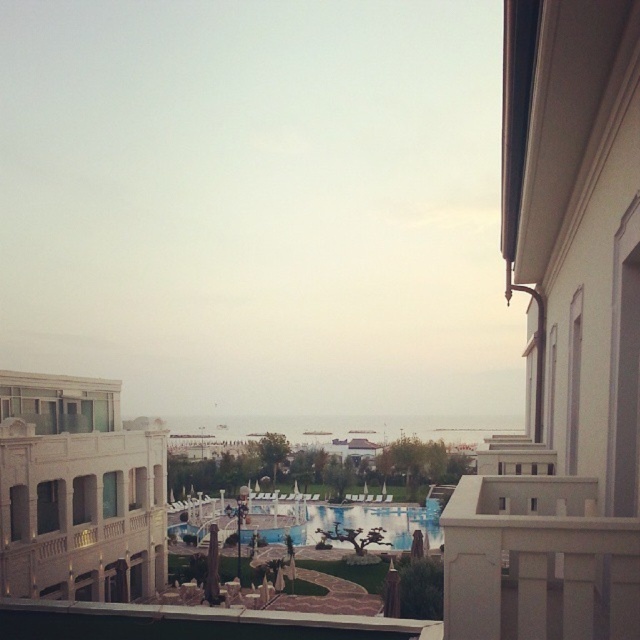
Who is positioned more to the right, white smooth building at right or white stone building at left?

Positioned to the right is white smooth building at right.

Is white smooth building at right to the right of white stone building at left from the viewer's perspective?

Yes, white smooth building at right is to the right of white stone building at left.

Is point (561, 44) more distant than point (67, 540)?

No, it is not.

Find the location of a particular element. white smooth building at right is located at coordinates (563, 342).

Can you confirm if white concrete balustrade at upper right is bigger than blue glossy pool at center?

No.

Does white concrete balustrade at upper right lie in front of blue glossy pool at center?

Yes.

At what (x,y) coordinates should I click in order to perform the action: click on white concrete balustrade at upper right. Please return your answer as a coordinate pair (x, y). The width and height of the screenshot is (640, 640). Looking at the image, I should click on click(538, 561).

Does white stone building at left have a larger size compared to white concrete balustrade at upper right?

Correct, white stone building at left is larger in size than white concrete balustrade at upper right.

Can you confirm if white stone building at left is wider than white concrete balustrade at upper right?

Correct, the width of white stone building at left exceeds that of white concrete balustrade at upper right.

The image size is (640, 640). I want to click on white stone building at left, so click(77, 490).

Where is `white stone building at left`? white stone building at left is located at coordinates (77, 490).